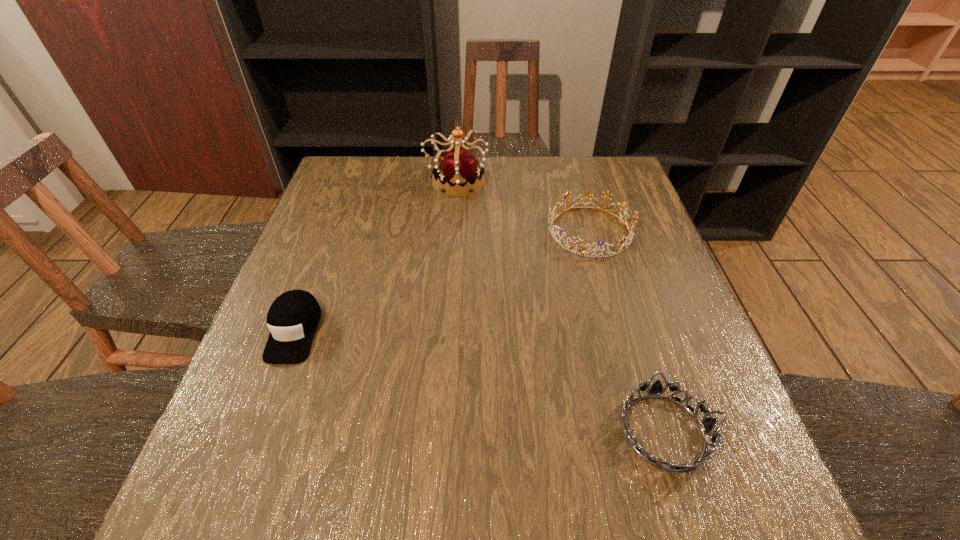
The width and height of the screenshot is (960, 540). I want to click on free area in between the nearest object and the third farthest object, so click(479, 381).

The image size is (960, 540). I want to click on free spot between the cap and the third nearest object, so click(442, 281).

Identify the location of vacant area between the cap and the nearest object. Image resolution: width=960 pixels, height=540 pixels. (479, 381).

Find the location of a particular element. This screenshot has width=960, height=540. vacant space that is in between the leftmost object and the farthest tiara is located at coordinates (375, 256).

I want to click on unoccupied area between the cap and the second farthest object, so (442, 281).

Locate an element on the screen. blank region between the shortest tiara and the second farthest object is located at coordinates (627, 331).

You are a GUI agent. You are given a task and a screenshot of the screen. Output one action in this format:
    pyautogui.click(x=<x>, y=<y>)
    Task: Click on the third closest object relative to the farthest object
    
    Given the screenshot: What is the action you would take?
    pyautogui.click(x=706, y=425)

Locate an element on the screen. The image size is (960, 540). object that is the second closest to the second farthest object is located at coordinates point(706,425).

Locate which tiara ranks second in proximity to the shortest object. Please provide its 2D coordinates. Your answer should be formatted as a tuple, i.e. [(x, y)], where the tuple contains the x and y coordinates of a point satisfying the conditions above.

[(459, 169)]

Choose which tiara is the second nearest neighbor to the second nearest tiara. Please provide its 2D coordinates. Your answer should be formatted as a tuple, i.e. [(x, y)], where the tuple contains the x and y coordinates of a point satisfying the conditions above.

[(706, 425)]